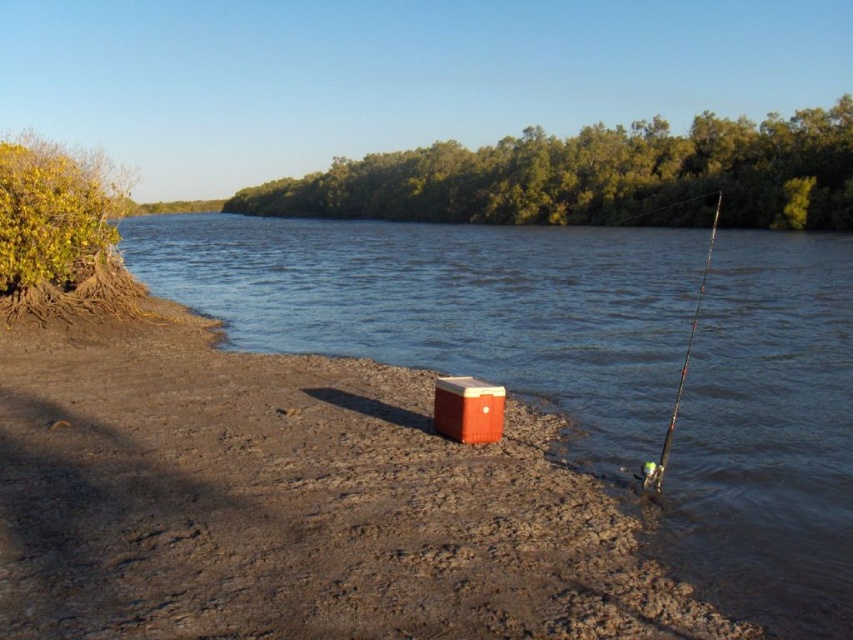
You are standing at the point with coordinates (454, 307) in the riverside scene. What type of terrain or surface would you expect to find there?

At point (454, 307) lies smooth water at center, so you would find smooth water there.

You are standing on the riverside and want to place a small boat in the smooth water at center. According to the scene description, where exactly should you place the boat?

The smooth water at center is located at point (454,307), so you should place the boat there.

You are a hiker who wants to cross the river using the smooth water at center. The shiny metallic fishing pole at right is 50.88 feet away from you. Can you safely cross the river if your backpack has a 50 feet rope?

The distance between the smooth water at center and the shiny metallic fishing pole at right is 50.88 feet. Since your backpack has a 50 feet rope, it is 0.88 feet shorter than needed. Therefore, the rope is insufficient to safely cross the river.